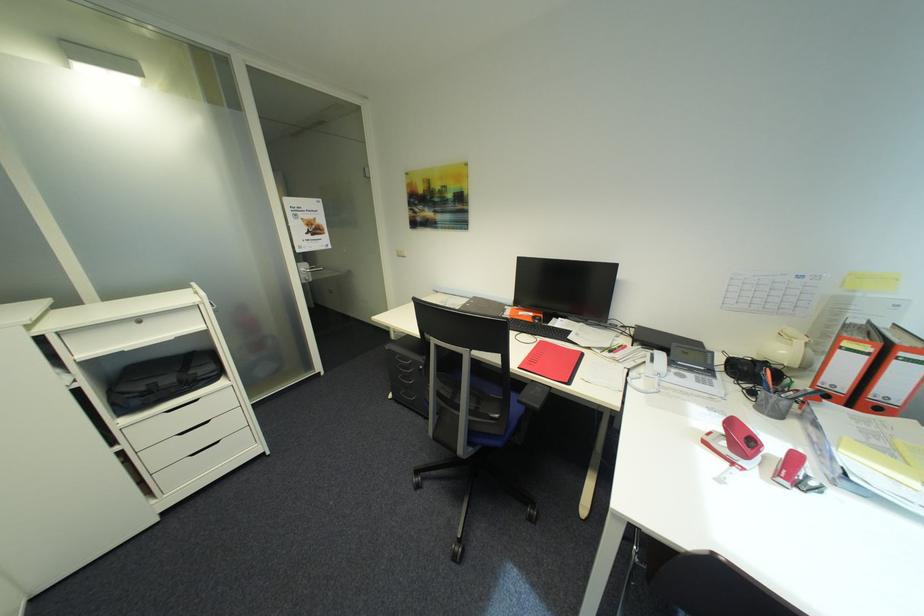
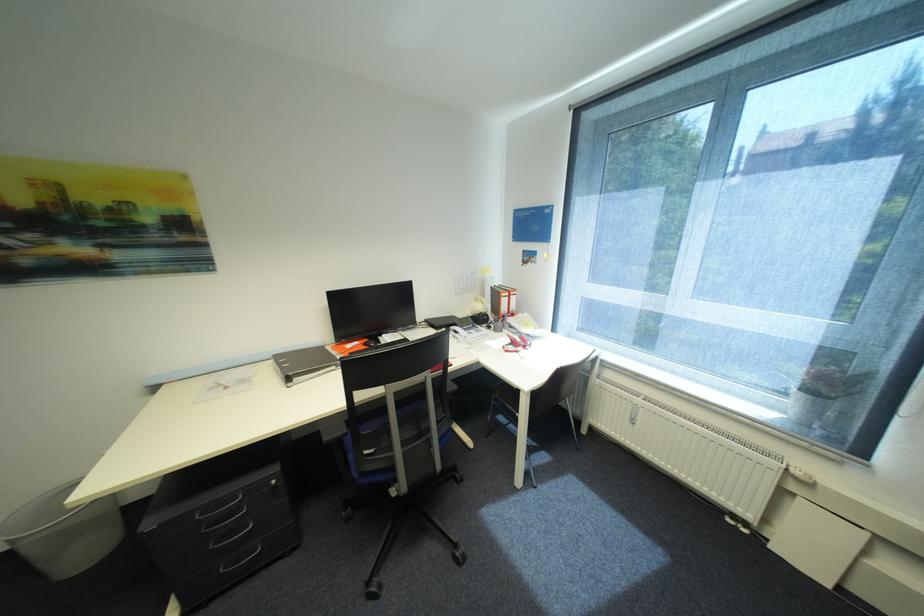
Question: I am providing you with two images of the same scene from different viewpoints. Please identify which objects are invisible in image2.

Choices:
 (A) white wall outlet
 (B) white window handle
 (C) red telephone handset
 (D) red notebook

Answer: (D)